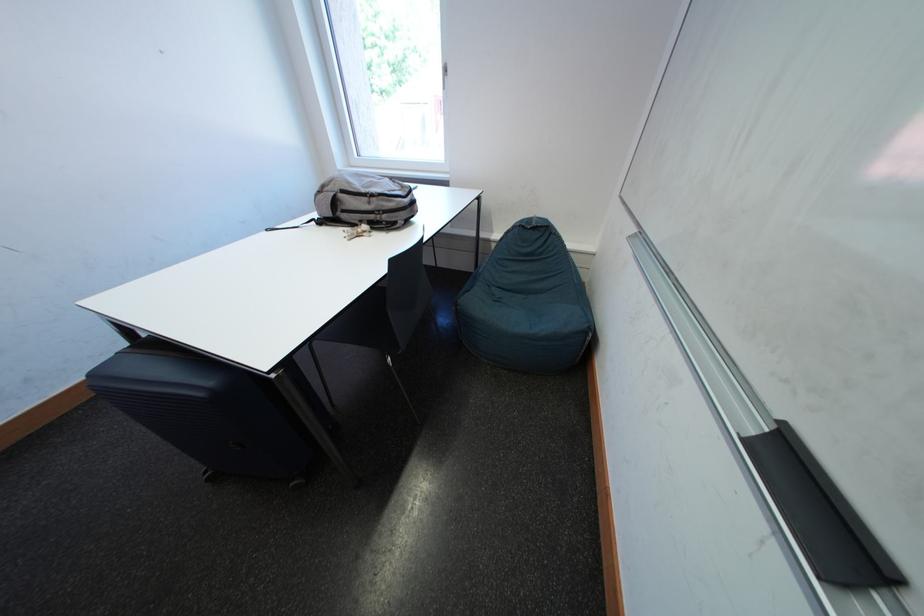
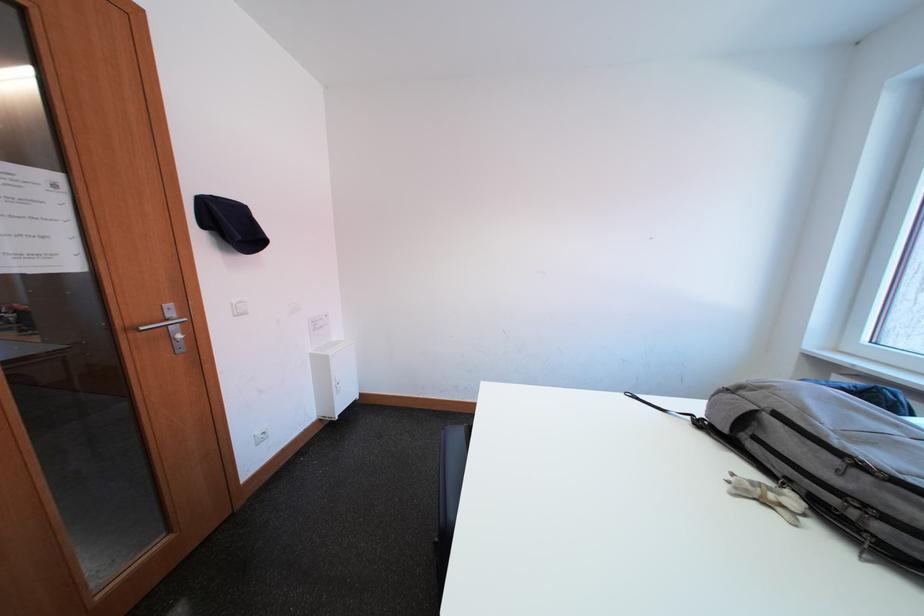
Locate, in the second image, the point that corresponds to point 375,203 in the first image.

(844, 464)